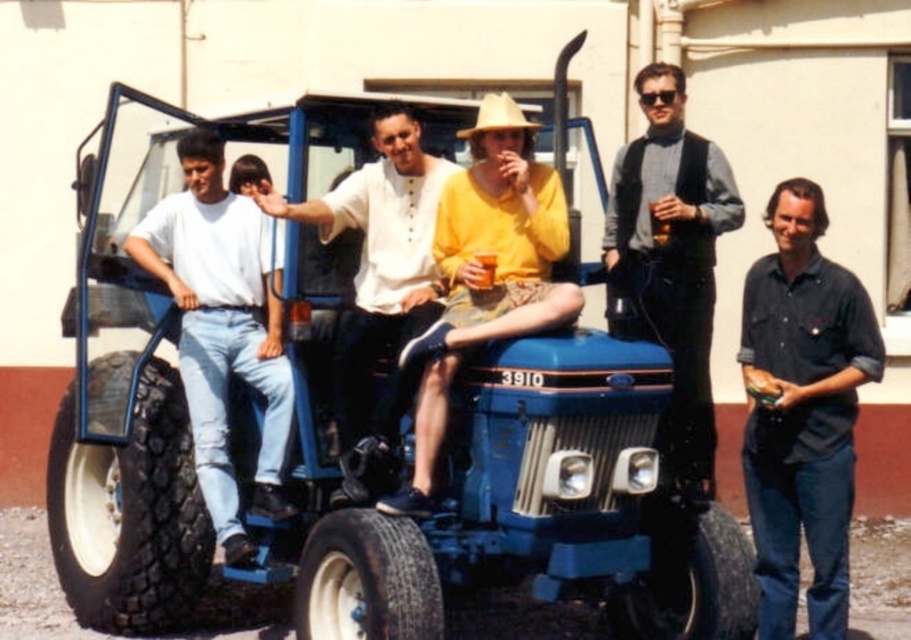
Consider the image. Can you confirm if blue rubber tractor at center is taller than tan straw cowboy hat at center?

Indeed, blue rubber tractor at center has a greater height compared to tan straw cowboy hat at center.

Does blue rubber tractor at center have a smaller size compared to tan straw cowboy hat at center?

No.

Is point (630, 481) less distant than point (484, 99)?

Yes.

Find the location of `blue rubber tractor at center`. blue rubber tractor at center is located at coordinates (356, 444).

Who is lower down, knit sweater vest at center or tan straw cowboy hat at center?

knit sweater vest at center is lower down.

Can you confirm if knit sweater vest at center is wider than tan straw cowboy hat at center?

Yes, knit sweater vest at center is wider than tan straw cowboy hat at center.

Between point (673, 317) and point (492, 124), which one is positioned behind?

The point (673, 317) is more distant.

Find the location of `knit sweater vest at center`. knit sweater vest at center is located at coordinates (670, 259).

Who is positioned more to the left, yellow matte shirt at center or tan straw cowboy hat at center?

yellow matte shirt at center

Between point (484, 262) and point (510, 104), which one is positioned in front?

Point (484, 262) is in front.

Is point (489, 320) farther from viewer compared to point (469, 132)?

No, it is not.

In order to click on yellow matte shirt at center in this screenshot , I will do 485,282.